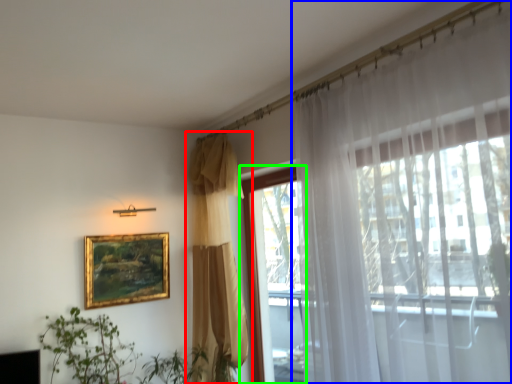
Question: Which object is the farthest from curtain (highlighted by a red box)? Choose among these: curtain (highlighted by a blue box) or window (highlighted by a green box).

Choices:
 (A) curtain
 (B) window

Answer: (A)